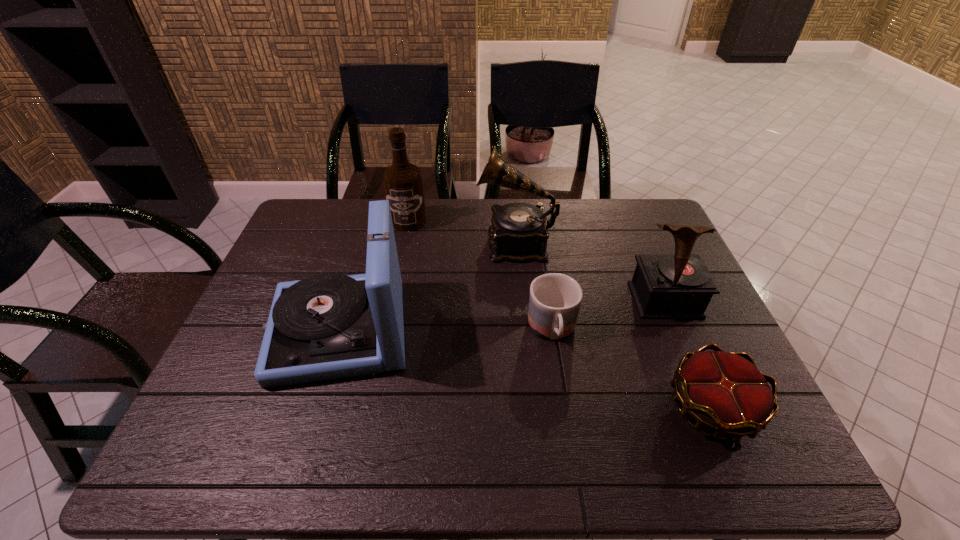
Where is `vacant point located between the crown and the leftmost phonograph_record`? The image size is (960, 540). vacant point located between the crown and the leftmost phonograph_record is located at coordinates (526, 368).

You are a GUI agent. You are given a task and a screenshot of the screen. Output one action in this format:
    pyautogui.click(x=<x>, y=<y>)
    Task: Click on the free space between the alcohol and the second phonograph_record from left to right
    
    Given the screenshot: What is the action you would take?
    pyautogui.click(x=462, y=232)

Find the location of a particular element. This screenshot has width=960, height=540. free spot between the leftmost phonograph_record and the second phonograph_record from left to right is located at coordinates (427, 286).

Where is `empty location between the mug and the leftmost phonograph_record`? empty location between the mug and the leftmost phonograph_record is located at coordinates (446, 330).

Find the location of a particular element. vacant space that is in between the leftmost phonograph_record and the crown is located at coordinates (526, 368).

Identify the location of the third closest object to the alcohol. The image size is (960, 540). (554, 301).

Locate which object is the fifth closest to the alcohol. Please provide its 2D coordinates. Your answer should be formatted as a tuple, i.e. [(x, y)], where the tuple contains the x and y coordinates of a point satisfying the conditions above.

[(725, 392)]

Locate which phonograph_record ranks in proximity to the alcohol. Please provide its 2D coordinates. Your answer should be formatted as a tuple, i.e. [(x, y)], where the tuple contains the x and y coordinates of a point satisfying the conditions above.

[(518, 233)]

What are the coordinates of `phonograph_record identified as the second closest to the farthest phonograph_record` in the screenshot? It's located at (664, 286).

Where is `vacant point that satisfies the following two spatial constraints: 1. on the side with the handle of the crown; 2. on the left side of the mug`? This screenshot has height=540, width=960. vacant point that satisfies the following two spatial constraints: 1. on the side with the handle of the crown; 2. on the left side of the mug is located at coordinates (564, 407).